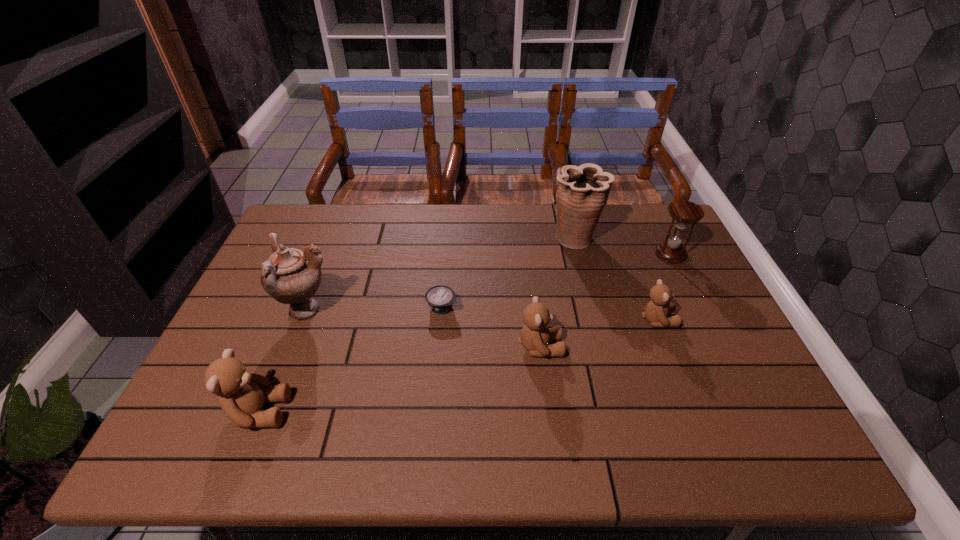
At what (x,y) coordinates should I click in order to perform the action: click on free space at the right edge. Please return your answer as a coordinate pair (x, y). The image size is (960, 540). Looking at the image, I should click on (706, 330).

Locate an element on the screen. vacant space at the far left corner of the desktop is located at coordinates [286, 239].

Image resolution: width=960 pixels, height=540 pixels. What are the coordinates of `vacant space at the near right corner` in the screenshot? It's located at (758, 385).

Find the location of `free space between the right urn and the second teddy bear from left to right`. free space between the right urn and the second teddy bear from left to right is located at coordinates (558, 293).

This screenshot has width=960, height=540. What are the coordinates of `empty space between the shortest object and the hourglass` in the screenshot? It's located at (556, 281).

Locate an element on the screen. unoccupied position between the farther urn and the left urn is located at coordinates pyautogui.click(x=442, y=274).

Identify the location of vacant space that is in between the nearest object and the yogurt. (350, 360).

Locate an element on the screen. This screenshot has width=960, height=540. free area in between the left urn and the rightmost object is located at coordinates (489, 282).

The height and width of the screenshot is (540, 960). In order to click on free area in between the nearest object and the rightmost object in this screenshot , I will do `click(465, 333)`.

Find the location of `vacant area between the farther urn and the hourglass`. vacant area between the farther urn and the hourglass is located at coordinates (622, 246).